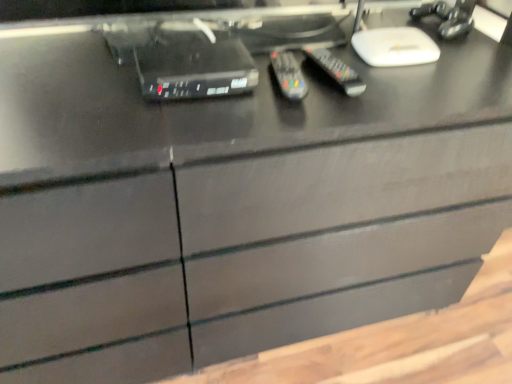
The image size is (512, 384). Find the location of `free space in front of black plastic remote at center, the second control when ordered from left to right`. free space in front of black plastic remote at center, the second control when ordered from left to right is located at coordinates (334, 109).